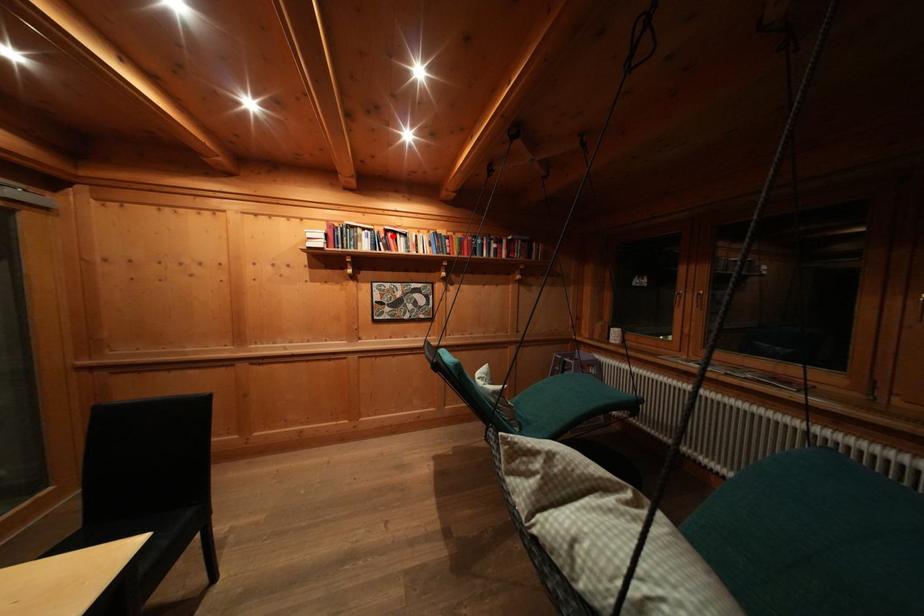
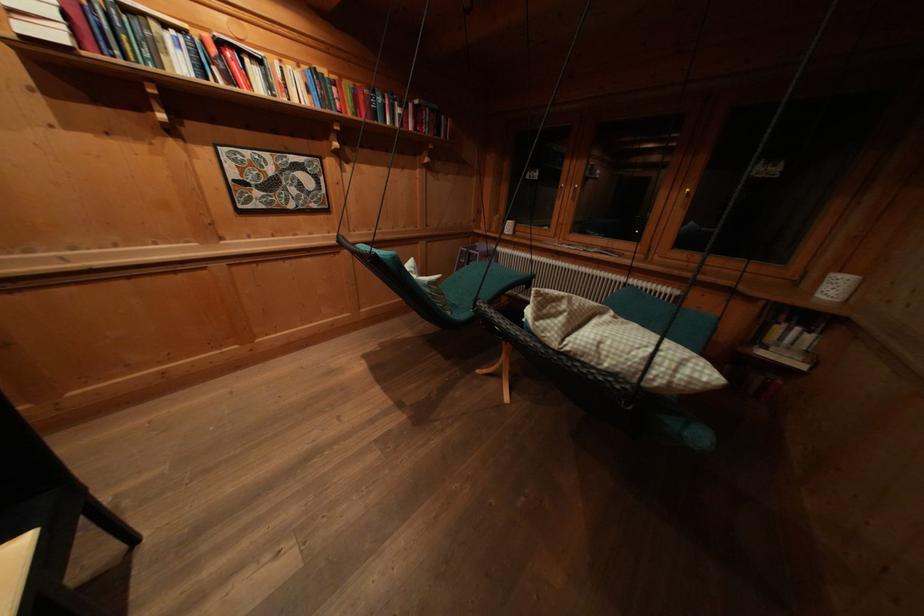
Question: I am providing you with two images of the same scene from different viewpoints. Given a red point in image1, look at the same physical point in image2. Is it:

Choices:
 (A) Closer to the viewpoint
 (B) Farther from the viewpoint

Answer: (B)